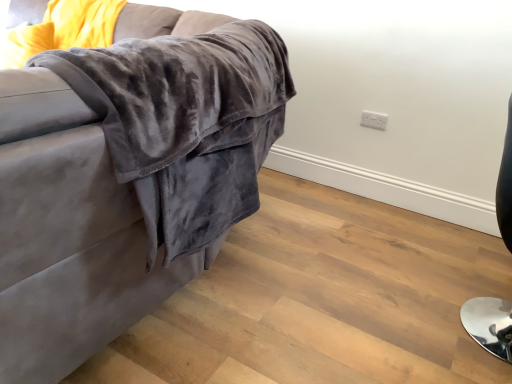
The width and height of the screenshot is (512, 384). What do you see at coordinates (489, 324) in the screenshot? I see `shiny black chair at right` at bounding box center [489, 324].

At what (x,y) coordinates should I click in order to perform the action: click on velvet gray couch at upper left. Please return your answer as a coordinate pair (x, y). This screenshot has height=384, width=512. Looking at the image, I should click on (125, 178).

From a real-world perspective, is shiny black chair at right physically located above or below white plastic electric outlet at upper right?

In terms of real-world spatial position, shiny black chair at right is below white plastic electric outlet at upper right.

Is white plastic electric outlet at upper right inside shiny black chair at right?

Actually, white plastic electric outlet at upper right is outside shiny black chair at right.

Locate an element on the screen. This screenshot has height=384, width=512. computer chair below the white plastic electric outlet at upper right (from the image's perspective) is located at coordinates (489, 324).

Does point (499, 181) lie behind point (372, 127)?

No.

Consider the image. Is velvet gray couch at upper left at the left side of white plastic electric outlet at upper right?

Yes, velvet gray couch at upper left is to the left of white plastic electric outlet at upper right.

From the image's perspective, is velvet gray couch at upper left above or below white plastic electric outlet at upper right?

Clearly, from the image's perspective, velvet gray couch at upper left is above white plastic electric outlet at upper right.

Is velvet gray couch at upper left oriented away from white plastic electric outlet at upper right?

Correct, velvet gray couch at upper left is looking away from white plastic electric outlet at upper right.

Is velvet gray couch at upper left shorter than white plastic electric outlet at upper right?

No.

From a real-world perspective, is white plastic electric outlet at upper right on velvet gray couch at upper left?

Actually, white plastic electric outlet at upper right is physically below velvet gray couch at upper left in the real world.

From the image's perspective, between white plastic electric outlet at upper right and velvet gray couch at upper left, which one is located above?

From the image's view, velvet gray couch at upper left is above.

Considering the sizes of objects white plastic electric outlet at upper right and velvet gray couch at upper left in the image provided, who is wider, white plastic electric outlet at upper right or velvet gray couch at upper left?

velvet gray couch at upper left.

Is there a large distance between white plastic electric outlet at upper right and velvet gray couch at upper left?

Yes.

From the image's perspective, which one is positioned lower, shiny black chair at right or velvet gray couch at upper left?

From the image's view, shiny black chair at right is below.

Which is in front, shiny black chair at right or velvet gray couch at upper left?

velvet gray couch at upper left.

Does point (501, 318) come behind point (178, 235)?

That is True.

Which is more to the right, shiny black chair at right or velvet gray couch at upper left?

shiny black chair at right is more to the right.

Is white plastic electric outlet at upper right turned away from shiny black chair at right?

No, shiny black chair at right is not at the back of white plastic electric outlet at upper right.

From the image's perspective, does white plastic electric outlet at upper right appear lower than shiny black chair at right?

Actually, white plastic electric outlet at upper right appears above shiny black chair at right in the image.

Looking at the image, does white plastic electric outlet at upper right seem bigger or smaller compared to shiny black chair at right?

Considering their sizes, white plastic electric outlet at upper right takes up less space than shiny black chair at right.

From a real-world perspective, who is located higher, white plastic electric outlet at upper right or shiny black chair at right?

white plastic electric outlet at upper right is physically above.

From a real-world perspective, does velvet gray couch at upper left stand above shiny black chair at right?

Indeed, from a real-world perspective, velvet gray couch at upper left stands above shiny black chair at right.

What's the angular difference between velvet gray couch at upper left and shiny black chair at right's facing directions?

The angular difference between velvet gray couch at upper left and shiny black chair at right is 90 degrees.

Is velvet gray couch at upper left in front of shiny black chair at right?

Yes, velvet gray couch at upper left is closer to the viewer.

This screenshot has width=512, height=384. Find the location of `computer chair to the right of white plastic electric outlet at upper right`. computer chair to the right of white plastic electric outlet at upper right is located at coordinates (489, 324).

In the image, there is a velvet gray couch at upper left. Identify the location of electric outlet below it (from the image's perspective). The width and height of the screenshot is (512, 384). (374, 120).

Estimate the real-world distances between objects in this image. Which object is closer to white plastic electric outlet at upper right, shiny black chair at right or velvet gray couch at upper left?

The object closer to white plastic electric outlet at upper right is shiny black chair at right.

When comparing their distances from white plastic electric outlet at upper right, does velvet gray couch at upper left or shiny black chair at right seem closer?

shiny black chair at right is positioned closer to the anchor white plastic electric outlet at upper right.

Considering their positions, is velvet gray couch at upper left positioned further to shiny black chair at right than white plastic electric outlet at upper right?

velvet gray couch at upper left is positioned further to the anchor shiny black chair at right.

When comparing their distances from velvet gray couch at upper left, does white plastic electric outlet at upper right or shiny black chair at right seem further?

white plastic electric outlet at upper right lies further to velvet gray couch at upper left than the other object.

When comparing their distances from velvet gray couch at upper left, does shiny black chair at right or white plastic electric outlet at upper right seem closer?

The object closer to velvet gray couch at upper left is shiny black chair at right.

Consider the image. Looking at the image, which one is located further to shiny black chair at right, white plastic electric outlet at upper right or velvet gray couch at upper left?

Among the two, velvet gray couch at upper left is located further to shiny black chair at right.

This screenshot has width=512, height=384. What are the coordinates of `electric outlet between velvet gray couch at upper left and shiny black chair at right in the horizontal direction` in the screenshot? It's located at (374, 120).